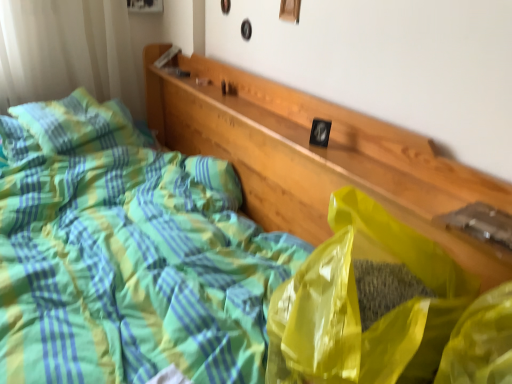
This screenshot has height=384, width=512. In order to click on yellow translucent plastic bag at center in this screenshot , I will do `click(358, 306)`.

The image size is (512, 384). What do you see at coordinates (358, 306) in the screenshot?
I see `yellow translucent plastic bag at center` at bounding box center [358, 306].

Consider the image. Measure the distance between yellow translucent plastic bag at center and camera.

The depth of yellow translucent plastic bag at center is 23.59 inches.

Locate an element on the screen. This screenshot has height=384, width=512. green plaid pillow at upper left is located at coordinates (78, 124).

What is the approximate width of green plaid pillow at upper left?

15.98 inches.

What do you see at coordinates (78, 124) in the screenshot?
I see `green plaid pillow at upper left` at bounding box center [78, 124].

This screenshot has height=384, width=512. What are the coordinates of `yellow translucent plastic bag at center` in the screenshot? It's located at (358, 306).

Can you confirm if green plaid pillow at upper left is positioned to the left of yellow translucent plastic bag at center?

Yes, green plaid pillow at upper left is to the left of yellow translucent plastic bag at center.

Which object is further away from the camera taking this photo, green plaid pillow at upper left or yellow translucent plastic bag at center?

Positioned behind is green plaid pillow at upper left.

Which point is more forward, (x=39, y=133) or (x=349, y=294)?

The point (x=349, y=294) is closer to the camera.

From the image's perspective, between green plaid pillow at upper left and yellow translucent plastic bag at center, which one is located above?

green plaid pillow at upper left, from the image's perspective.

From a real-world perspective, which object stands above the other?

yellow translucent plastic bag at center is physically above.

Looking at their sizes, would you say green plaid pillow at upper left is wider or thinner than yellow translucent plastic bag at center?

In the image, green plaid pillow at upper left appears to be wider than yellow translucent plastic bag at center.

Based on the photo, between green plaid pillow at upper left and yellow translucent plastic bag at center, which one has less height?

green plaid pillow at upper left is shorter.

From the picture: Can you confirm if green plaid pillow at upper left is bigger than yellow translucent plastic bag at center?

Incorrect, green plaid pillow at upper left is not larger than yellow translucent plastic bag at center.

Is green plaid pillow at upper left located outside yellow translucent plastic bag at center?

green plaid pillow at upper left is positioned outside yellow translucent plastic bag at center.

Is the surface of green plaid pillow at upper left in direct contact with yellow translucent plastic bag at center?

No, green plaid pillow at upper left is not with yellow translucent plastic bag at center.

Is green plaid pillow at upper left turned away from yellow translucent plastic bag at center?

green plaid pillow at upper left is not turned away from yellow translucent plastic bag at center.

What's the angular difference between green plaid pillow at upper left and yellow translucent plastic bag at center's facing directions?

They differ by 161 degrees in their facing directions.

At what (x,y) coordinates should I click in order to perform the action: click on pillow above the yellow translucent plastic bag at center (from the image's perspective). Please return your answer as a coordinate pair (x, y). The image size is (512, 384). Looking at the image, I should click on (78, 124).

Considering the relative positions of yellow translucent plastic bag at center and green plaid pillow at upper left in the image provided, is yellow translucent plastic bag at center to the right of green plaid pillow at upper left from the viewer's perspective?

Indeed, yellow translucent plastic bag at center is positioned on the right side of green plaid pillow at upper left.

Is yellow translucent plastic bag at center further to camera compared to green plaid pillow at upper left?

No, it is not.

Which is further, (284, 288) or (80, 90)?

The point (80, 90) is more distant.

From the image's perspective, which one is positioned higher, yellow translucent plastic bag at center or green plaid pillow at upper left?

green plaid pillow at upper left appears higher in the image.

From a real-world perspective, is yellow translucent plastic bag at center below green plaid pillow at upper left?

Actually, yellow translucent plastic bag at center is physically above green plaid pillow at upper left in the real world.

Based on the photo, in terms of width, does yellow translucent plastic bag at center look wider or thinner when compared to green plaid pillow at upper left?

Clearly, yellow translucent plastic bag at center has less width compared to green plaid pillow at upper left.

From their relative heights in the image, would you say yellow translucent plastic bag at center is taller or shorter than green plaid pillow at upper left?

yellow translucent plastic bag at center is taller than green plaid pillow at upper left.

Does yellow translucent plastic bag at center have a smaller size compared to green plaid pillow at upper left?

No, yellow translucent plastic bag at center is not smaller than green plaid pillow at upper left.

Choose the correct answer: Is yellow translucent plastic bag at center inside green plaid pillow at upper left or outside it?

yellow translucent plastic bag at center exists outside the volume of green plaid pillow at upper left.

Is yellow translucent plastic bag at center touching green plaid pillow at upper left?

No, yellow translucent plastic bag at center is not making contact with green plaid pillow at upper left.

Is yellow translucent plastic bag at center facing away from green plaid pillow at upper left?

No, yellow translucent plastic bag at center's orientation is not away from green plaid pillow at upper left.

What's the angular difference between yellow translucent plastic bag at center and green plaid pillow at upper left's facing directions?

161 degrees.

Identify the location of plastic bag above the green plaid pillow at upper left (from a real-world perspective). Image resolution: width=512 pixels, height=384 pixels. (358, 306).

Find the location of a particular element. The height and width of the screenshot is (384, 512). plastic bag on the right of green plaid pillow at upper left is located at coordinates [358, 306].

The width and height of the screenshot is (512, 384). Find the location of `plastic bag in front of the green plaid pillow at upper left`. plastic bag in front of the green plaid pillow at upper left is located at coordinates (358, 306).